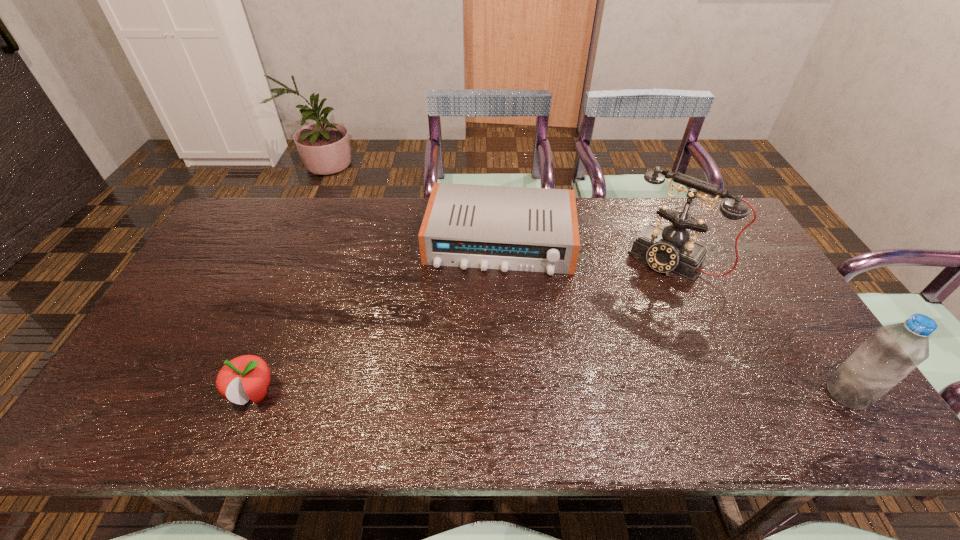
Identify the location of vacant region located on the control panel of the second object from left to right. The width and height of the screenshot is (960, 540). (490, 323).

The width and height of the screenshot is (960, 540). I want to click on vacant area located on the control panel of the second object from left to right, so click(x=486, y=367).

This screenshot has height=540, width=960. Find the location of `telephone present at the far edge`. telephone present at the far edge is located at coordinates (666, 250).

Find the location of a particular element. radio receiver present at the far edge is located at coordinates (477, 226).

Identify the location of apple situated at the near edge. The image size is (960, 540). [247, 377].

Locate an element on the screen. This screenshot has height=540, width=960. water bottle located at the near edge is located at coordinates (893, 351).

The height and width of the screenshot is (540, 960). In order to click on water bottle present at the right edge in this screenshot , I will do `click(893, 351)`.

This screenshot has height=540, width=960. In order to click on telephone situated at the right edge in this screenshot , I will do `click(666, 250)`.

You are a GUI agent. You are given a task and a screenshot of the screen. Output one action in this format:
    pyautogui.click(x=<x>, y=<y>)
    Task: Click on the object at the far right corner
    The image size is (960, 540).
    Given the screenshot: What is the action you would take?
    pyautogui.click(x=666, y=250)

Locate an element on the screen. object present at the near right corner is located at coordinates (893, 351).